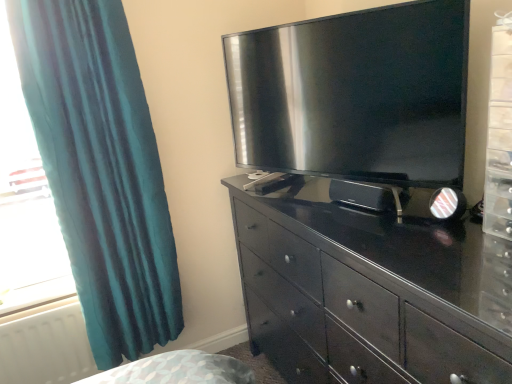
Question: Can you confirm if teal fabric curtain at left is wider than black glossy television at upper center?

Choices:
 (A) no
 (B) yes

Answer: (B)

Question: Is teal fabric curtain at left far away from black glossy television at upper center?

Choices:
 (A) yes
 (B) no

Answer: (B)

Question: Is teal fabric curtain at left taller than black glossy television at upper center?

Choices:
 (A) no
 (B) yes

Answer: (B)

Question: Is teal fabric curtain at left bigger than black glossy television at upper center?

Choices:
 (A) no
 (B) yes

Answer: (B)

Question: Is teal fabric curtain at left further to camera compared to black glossy television at upper center?

Choices:
 (A) no
 (B) yes

Answer: (B)

Question: Is teal fabric curtain at left located outside black glossy television at upper center?

Choices:
 (A) no
 (B) yes

Answer: (B)

Question: Can you confirm if black glossy television at upper center is wider than white matte radiator at lower left?

Choices:
 (A) no
 (B) yes

Answer: (B)

Question: Does black glossy television at upper center have a smaller size compared to white matte radiator at lower left?

Choices:
 (A) no
 (B) yes

Answer: (A)

Question: Is black glossy television at upper center with white matte radiator at lower left?

Choices:
 (A) no
 (B) yes

Answer: (A)

Question: From the image's perspective, is black glossy television at upper center above white matte radiator at lower left?

Choices:
 (A) yes
 (B) no

Answer: (A)

Question: Is the position of black glossy television at upper center less distant than that of white matte radiator at lower left?

Choices:
 (A) yes
 (B) no

Answer: (A)

Question: Is black glossy television at upper center oriented towards white matte radiator at lower left?

Choices:
 (A) no
 (B) yes

Answer: (A)

Question: Does white matte radiator at lower left turn towards black glossy television at upper center?

Choices:
 (A) no
 (B) yes

Answer: (A)